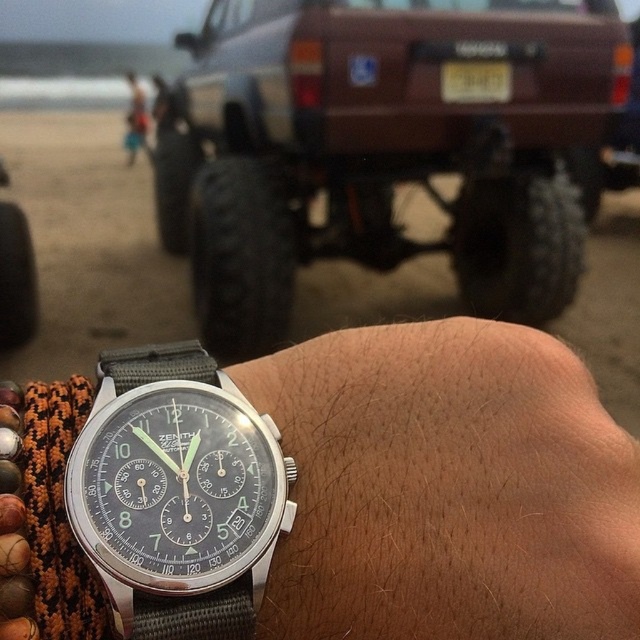
Question: Is the position of metallic watch at center less distant than that of yellow matte license plate at center?

Choices:
 (A) yes
 (B) no

Answer: (A)

Question: Which object is the farthest from the silver metallic watch at center?

Choices:
 (A) yellow matte license plate at center
 (B) metallic watch at center

Answer: (A)

Question: Which of the following is the farthest from the observer?

Choices:
 (A) metallic watch at center
 (B) brown matte jeep at center

Answer: (B)

Question: Is metallic watch at center smaller than yellow matte license plate at center?

Choices:
 (A) yes
 (B) no

Answer: (B)

Question: Can you confirm if brown matte jeep at center is positioned to the left of metallic watch at center?

Choices:
 (A) no
 (B) yes

Answer: (A)

Question: Which of the following is the farthest from the observer?

Choices:
 (A) silver metallic watch at center
 (B) brown matte jeep at center
 (C) yellow matte license plate at center

Answer: (C)